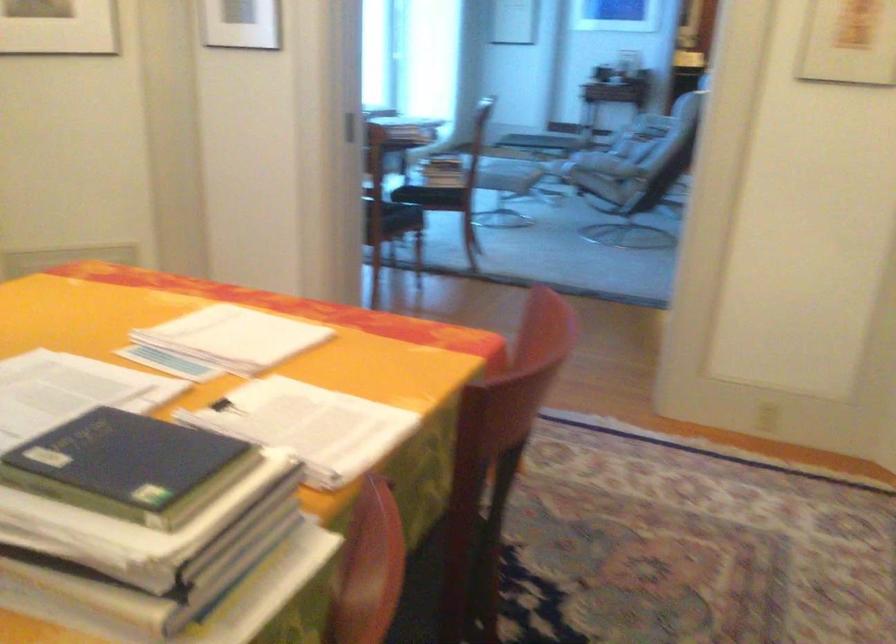
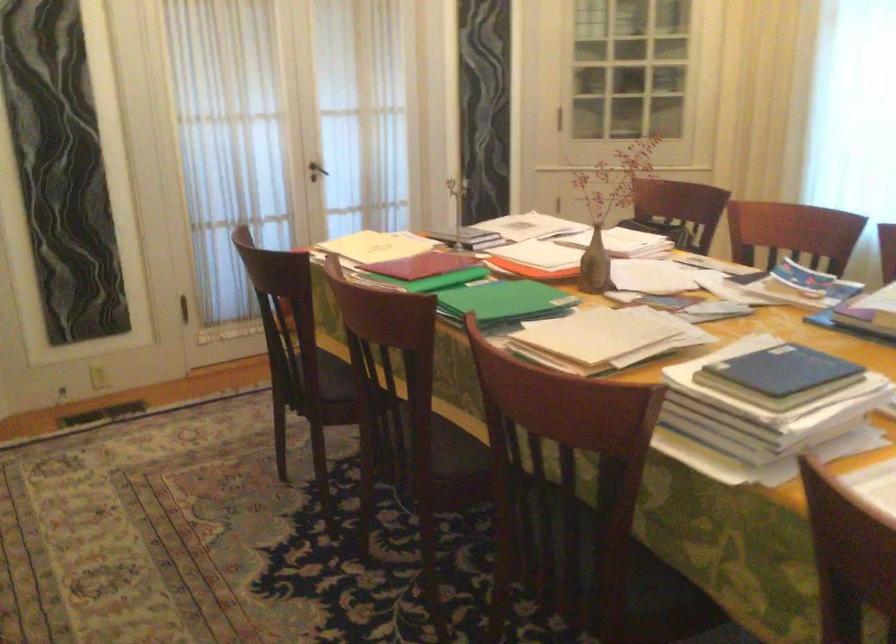
Where in the second image is the point corresponding to point 200,507 from the first image?

(782, 370)